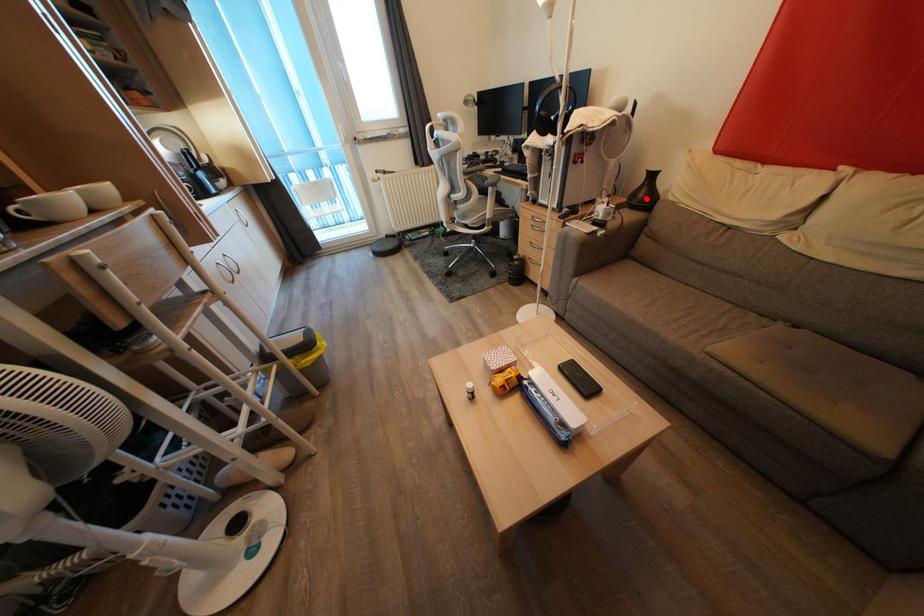
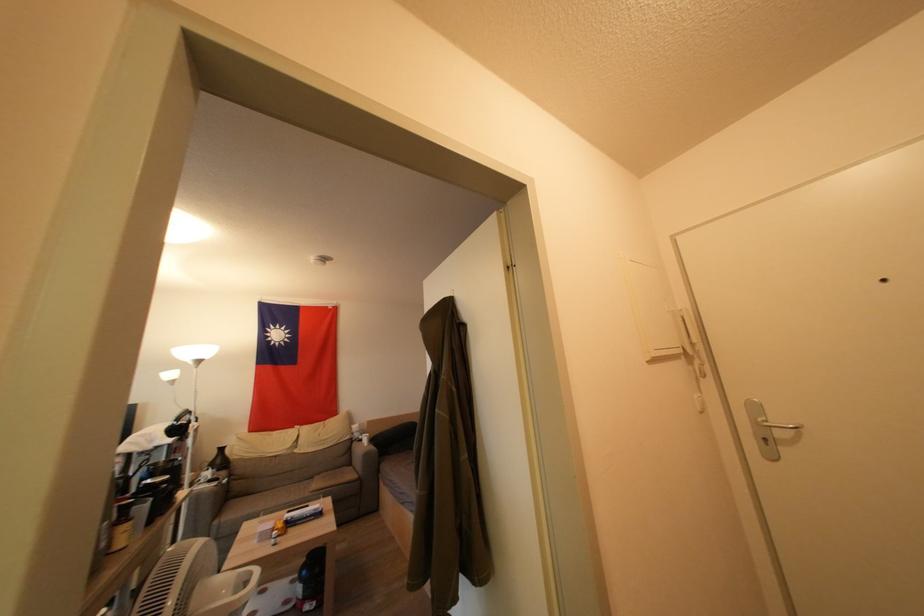
In the second image, find the point that corresponds to the highlighted location in the first image.

(224, 464)